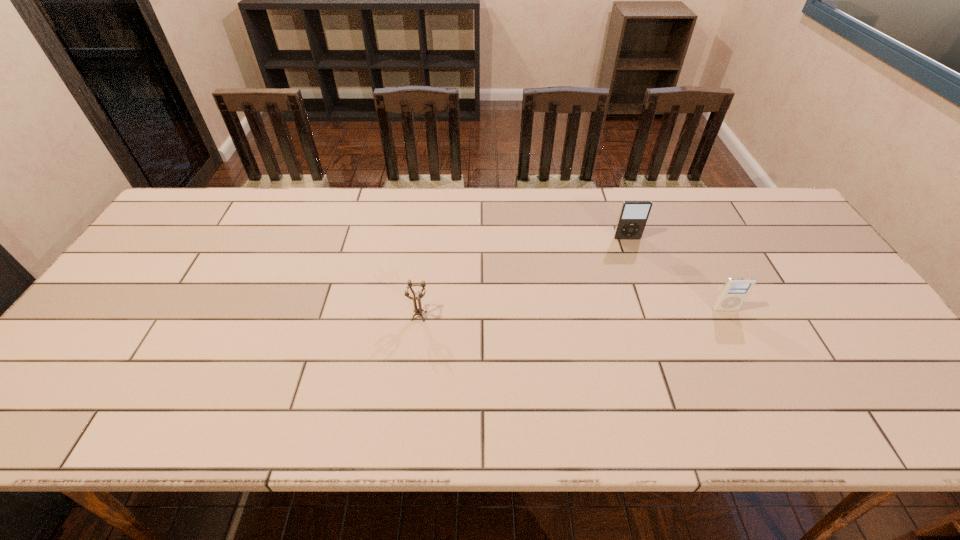
You are a GUI agent. You are given a task and a screenshot of the screen. Output one action in this format:
    pyautogui.click(x=<x>, y=<y>)
    Task: Click on the vacant space at the left edge of the desktop
    The height and width of the screenshot is (540, 960).
    Given the screenshot: What is the action you would take?
    pyautogui.click(x=163, y=307)

Identify the location of vacant space at the far right corner of the desktop. The height and width of the screenshot is (540, 960). (744, 230).

Image resolution: width=960 pixels, height=540 pixels. Find the location of `vacant space at the near right corner`. vacant space at the near right corner is located at coordinates (893, 418).

Find the location of a particular element. free spot between the right iPod and the leftmost object is located at coordinates (572, 313).

Where is `free space between the rightmost object and the candle holder`? Image resolution: width=960 pixels, height=540 pixels. free space between the rightmost object and the candle holder is located at coordinates (572, 313).

The width and height of the screenshot is (960, 540). What are the coordinates of `blank region between the leftmost object and the farthest object` in the screenshot? It's located at (523, 277).

Find the location of a particular element. The height and width of the screenshot is (540, 960). empty location between the nearer iPod and the leftmost object is located at coordinates (572, 313).

Locate an element on the screen. vacant point located between the second object from left to right and the nearer iPod is located at coordinates (676, 274).

Locate an element on the screen. The width and height of the screenshot is (960, 540). vacant region between the farther iPod and the right iPod is located at coordinates pyautogui.click(x=676, y=274).

You are a GUI agent. You are given a task and a screenshot of the screen. Output one action in this format:
    pyautogui.click(x=<x>, y=<y>)
    Task: Click on the free spot between the leftmost object and the second object from left to right
    This screenshot has width=960, height=540.
    Given the screenshot: What is the action you would take?
    pyautogui.click(x=523, y=277)